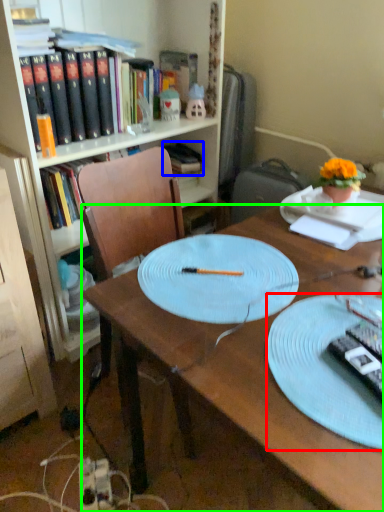
Question: Based on their relative distances, which object is nearer to plate (highlighted by a red box)? Choose from book (highlighted by a blue box) and desk (highlighted by a green box).

Choices:
 (A) book
 (B) desk

Answer: (B)